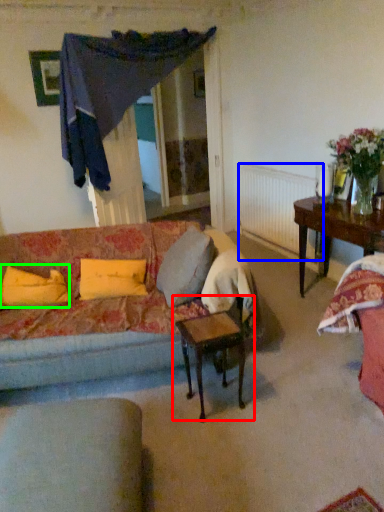
Question: Estimate the real-world distances between objects in this image. Which object is farther from table (highlighted by a red box), radiator (highlighted by a blue box) or pillow (highlighted by a green box)?

Choices:
 (A) radiator
 (B) pillow

Answer: (A)